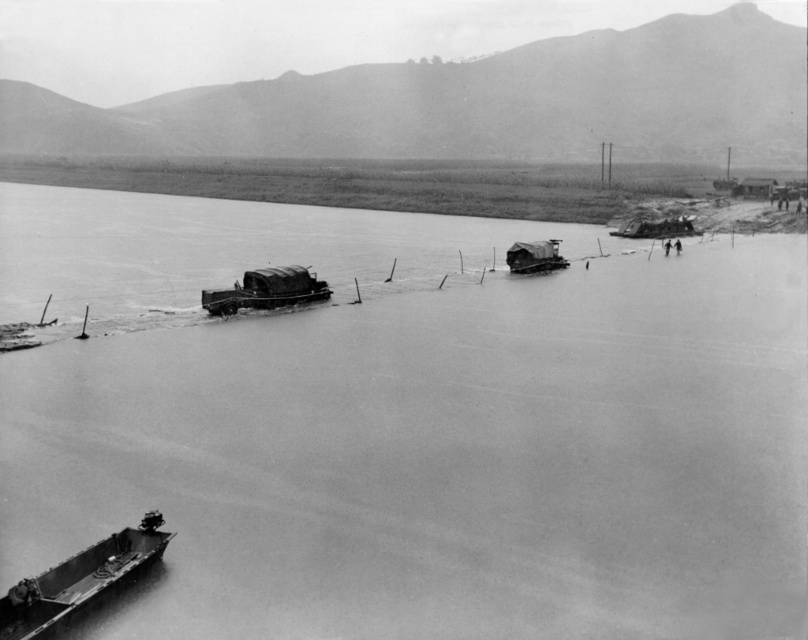
Question: Among these points, which one is nearest to the camera?

Choices:
 (A) (691, 225)
 (B) (266, 300)

Answer: (B)

Question: Does smooth water at center have a greater width compared to metallic gray boat at center?

Choices:
 (A) no
 (B) yes

Answer: (B)

Question: Can you confirm if smooth water at center is thinner than smooth wooden boat at lower left?

Choices:
 (A) yes
 (B) no

Answer: (B)

Question: Is wooden planks boat at center above metallic gray boat at right?

Choices:
 (A) no
 (B) yes

Answer: (A)

Question: Among these objects, which one is nearest to the camera?

Choices:
 (A) metallic gray boat at center
 (B) wooden planks boat at center
 (C) metallic gray boat at right
 (D) smooth water at center

Answer: (D)

Question: Which of these objects is positioned farthest from the wooden planks boat at center?

Choices:
 (A) metallic gray boat at right
 (B) metallic gray boat at center
 (C) smooth wooden boat at lower left
 (D) smooth water at center

Answer: (C)